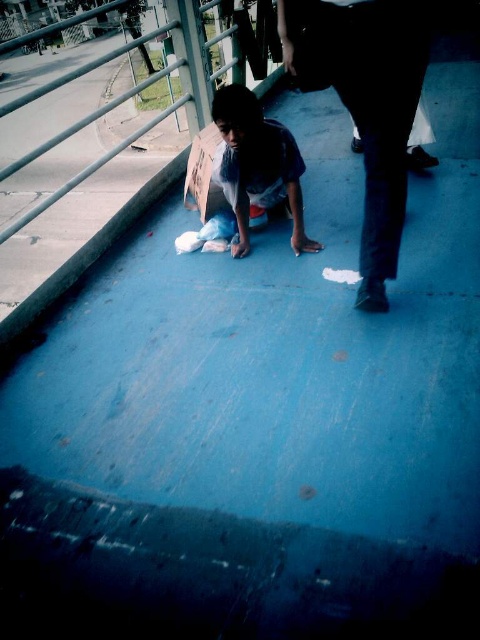
Question: Does dark fabric pants at center have a lesser width compared to blue denim jeans at center?

Choices:
 (A) no
 (B) yes

Answer: (B)

Question: Does dark fabric pants at center appear over blue denim jeans at center?

Choices:
 (A) yes
 (B) no

Answer: (B)

Question: Which of the following is the closest to the observer?

Choices:
 (A) (383, 93)
 (B) (278, 138)

Answer: (A)

Question: Is dark fabric pants at center below blue denim jeans at center?

Choices:
 (A) yes
 (B) no

Answer: (A)